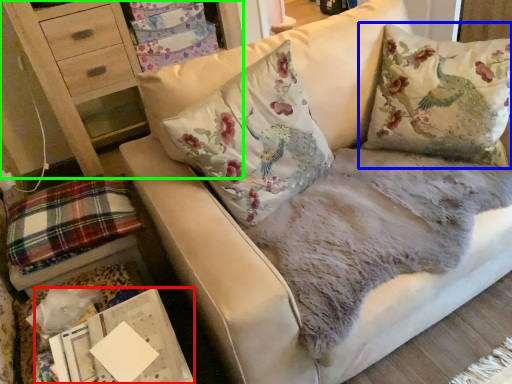
Question: Considering the real-world distances, which object is farthest from magazine (highlighted by a red box)? pillow (highlighted by a blue box) or furniture (highlighted by a green box)?

Choices:
 (A) pillow
 (B) furniture

Answer: (B)